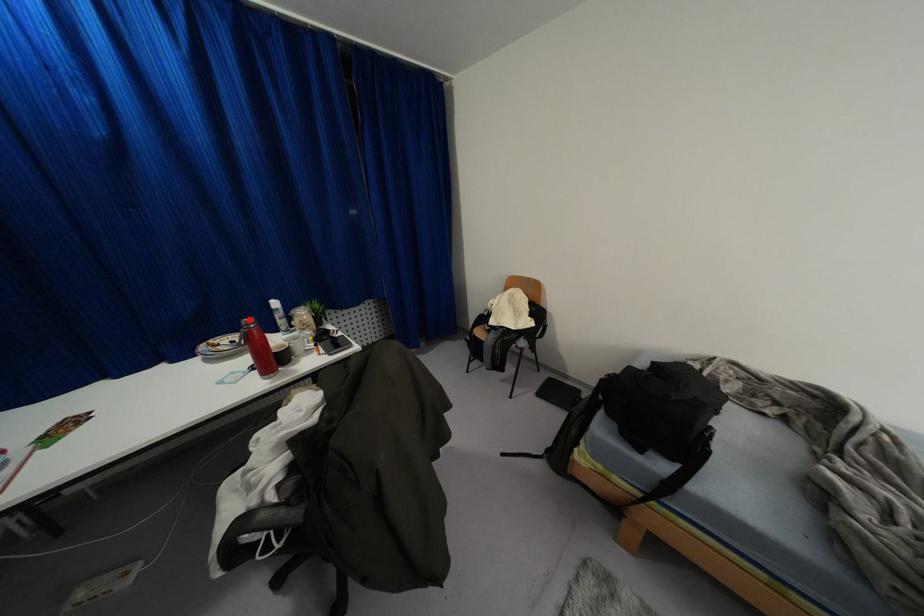
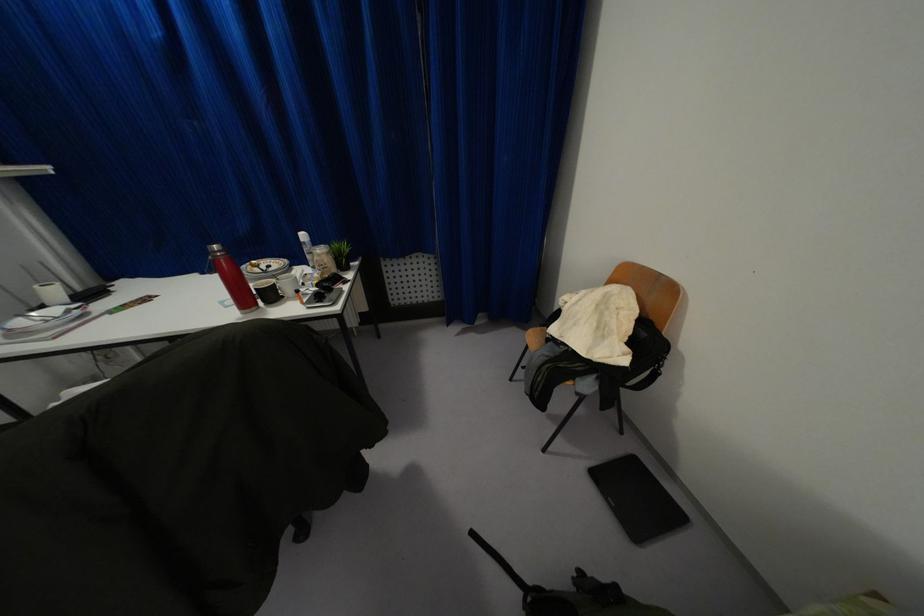
The point at the highlighted location is marked in the first image. Where is the corresponding point in the second image?

(214, 246)